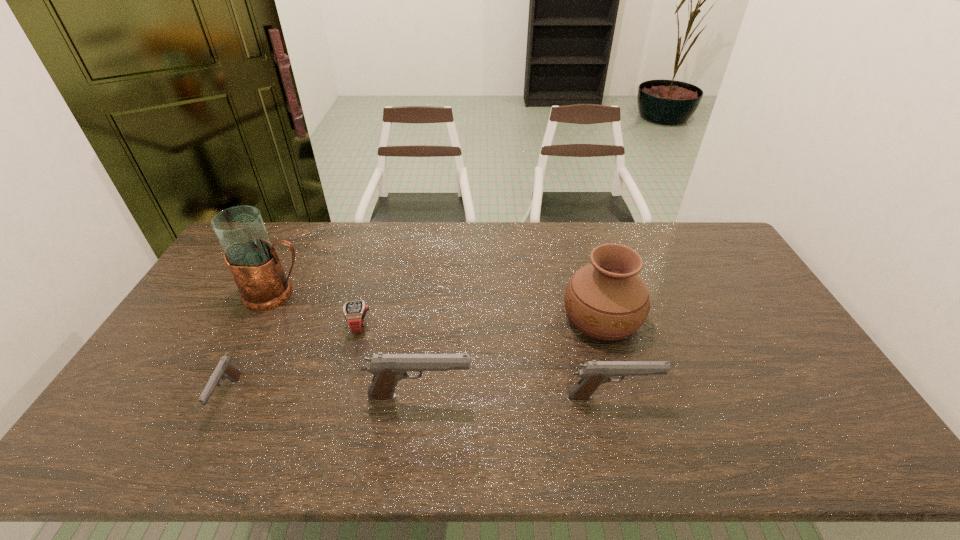
Select which pistol appears as the closest to the shortest object. Please provide its 2D coordinates. Your answer should be formatted as a tuple, i.e. [(x, y)], where the tuple contains the x and y coordinates of a point satisfying the conditions above.

[(388, 369)]

At what (x,y) coordinates should I click in order to perform the action: click on vacant space that satisfies the following two spatial constraints: 1. on the front side of the second tallest object; 2. at the barrel of the fourth object from left to right. Please return your answer as a coordinate pair (x, y). This screenshot has width=960, height=540. Looking at the image, I should click on (625, 396).

Identify the location of free region that satisfies the following two spatial constraints: 1. on the back side of the urn; 2. with the handle on the side of the tallest object. (596, 294).